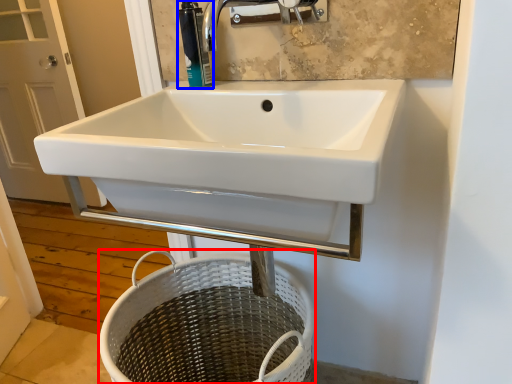
Question: Which object appears farthest to the camera in this image, basket (highlighted by a red box) or soap dispenser (highlighted by a blue box)?

Choices:
 (A) basket
 (B) soap dispenser

Answer: (B)